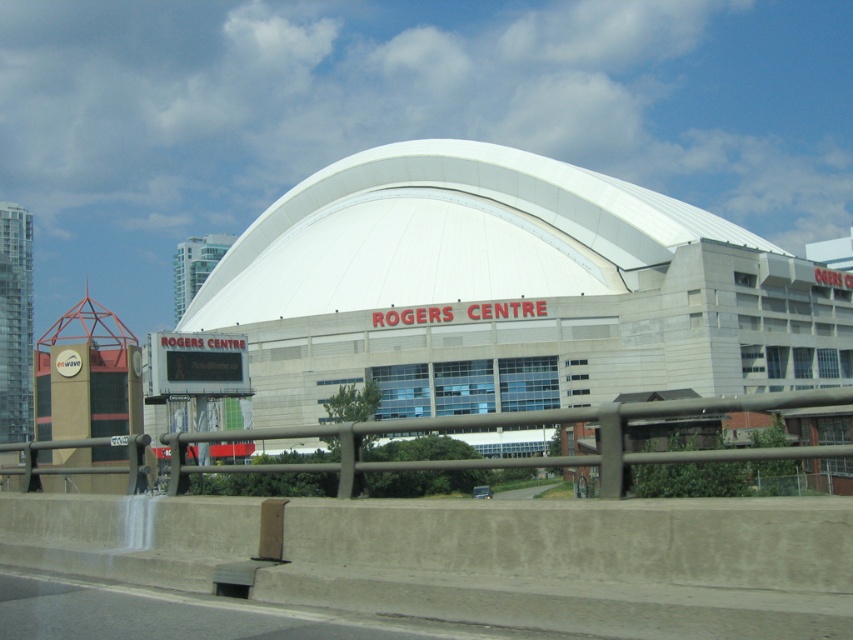
You are standing at the camera position and want to walk to the matte brown building at center. How far will you have to walk in meters?

The matte brown building at center is 53.22 meters away from the camera, so you will have to walk 53.22 meters to reach it.

You are standing at the point marked by coordinates point (511, 291) in the image of the Rogers Centre. What structure are you facing directly in front of you?

The point (511, 291) marks the matte brown building at center, so you are facing the matte brown building at center directly in front of you.